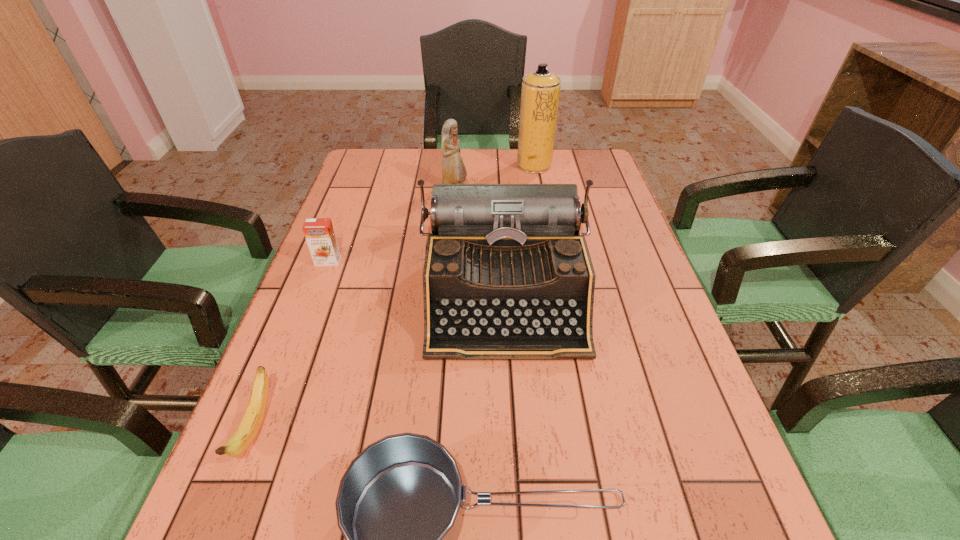
Identify the location of aerosol can that is at the far edge. The height and width of the screenshot is (540, 960). (540, 91).

Where is `figurine located at the far edge`? figurine located at the far edge is located at coordinates (453, 169).

Identify the location of orange juice at the left edge. Image resolution: width=960 pixels, height=540 pixels. (319, 233).

Find the location of `banana that is at the left edge`. banana that is at the left edge is located at coordinates (249, 427).

Identify the location of object present at the right edge. (507, 275).

You are a GUI agent. You are given a task and a screenshot of the screen. Output one action in this format:
    pyautogui.click(x=<x>, y=<y>)
    Task: Click on the blank space at the far edge of the desktop
    This screenshot has width=960, height=540.
    Given the screenshot: What is the action you would take?
    tap(425, 180)

This screenshot has height=540, width=960. Find the location of `vacant area at the left edge of the desktop`. vacant area at the left edge of the desktop is located at coordinates (361, 267).

At what (x,y) coordinates should I click in order to perform the action: click on vacant region at the right edge of the desktop. Please return your answer as a coordinate pair (x, y). Image resolution: width=960 pixels, height=540 pixels. Looking at the image, I should click on (602, 274).

In the image, there is a desktop. In order to click on vacant space at the far left corner in this screenshot , I will do `click(382, 184)`.

At what (x,y) coordinates should I click in order to perform the action: click on free space that is in between the aerosol can and the fifth nearest object. Please return your answer as a coordinate pair (x, y). The width and height of the screenshot is (960, 540). Looking at the image, I should click on (494, 177).